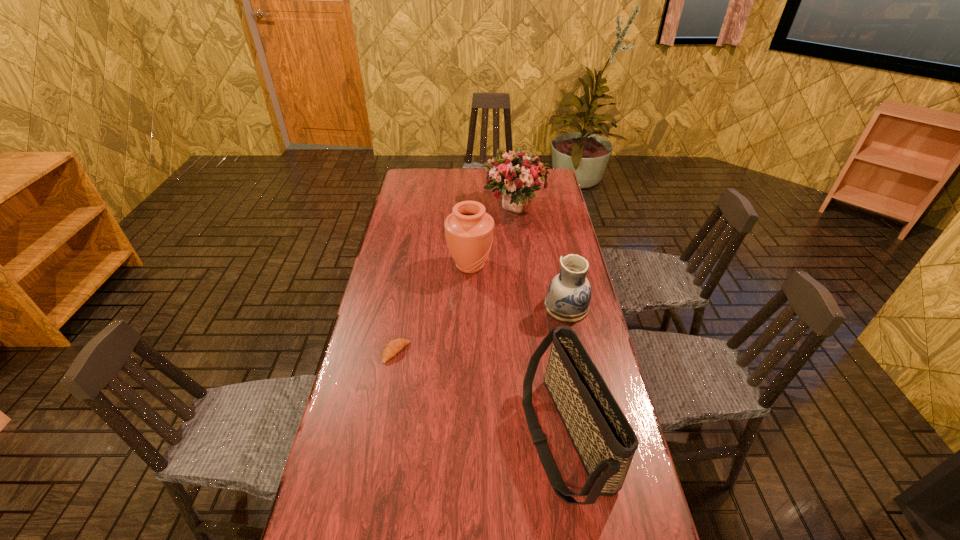
Where is `vacant space at the far left corner of the desktop`? This screenshot has width=960, height=540. vacant space at the far left corner of the desktop is located at coordinates (427, 170).

Find the location of a particular element. This screenshot has width=960, height=540. vacant area between the pottery and the bouquet is located at coordinates (540, 256).

I want to click on empty space between the pottery and the vase, so click(x=518, y=286).

The image size is (960, 540). Identify the location of empty location between the vase and the pottery. (518, 286).

Where is `vacant point located between the leftmost object and the pottery`? The height and width of the screenshot is (540, 960). vacant point located between the leftmost object and the pottery is located at coordinates (481, 329).

Where is `free space between the nearest object and the fourth farthest object`? This screenshot has height=540, width=960. free space between the nearest object and the fourth farthest object is located at coordinates (481, 395).

Identify the location of vacant area that lies between the handbag and the fourth nearest object. (518, 352).

This screenshot has height=540, width=960. What are the coordinates of `free area in between the vase and the pottery` in the screenshot? It's located at (518, 286).

Locate an element on the screen. This screenshot has height=540, width=960. free space between the pottery and the second farthest object is located at coordinates (518, 286).

This screenshot has width=960, height=540. Find the location of `vacant space that's between the nearest object and the bouquet`. vacant space that's between the nearest object and the bouquet is located at coordinates (540, 322).